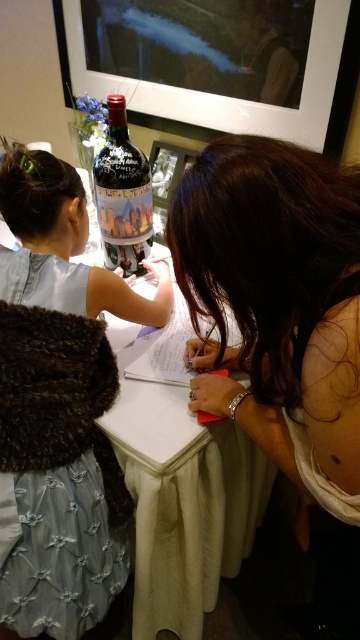
Question: Which object is positioned closest to the light blue denim dress at lower left?

Choices:
 (A) brown hair at upper center
 (B) white cloth-covered table at center
 (C) matte glass bottle at center

Answer: (B)

Question: Which is farther from the light blue denim dress at lower left?

Choices:
 (A) matte glass bottle at center
 (B) brown hair at upper center

Answer: (B)

Question: Which object appears closest to the camera in this image?

Choices:
 (A) matte glass bottle at center
 (B) white cloth-covered table at center

Answer: (B)

Question: Is light blue denim dress at lower left closer to the viewer compared to matte glass bottle at center?

Choices:
 (A) yes
 (B) no

Answer: (A)

Question: Does brown hair at upper center appear on the left side of light blue denim dress at lower left?

Choices:
 (A) yes
 (B) no

Answer: (B)

Question: Can you confirm if brown hair at upper center is positioned to the right of matte glass bottle at center?

Choices:
 (A) yes
 (B) no

Answer: (A)